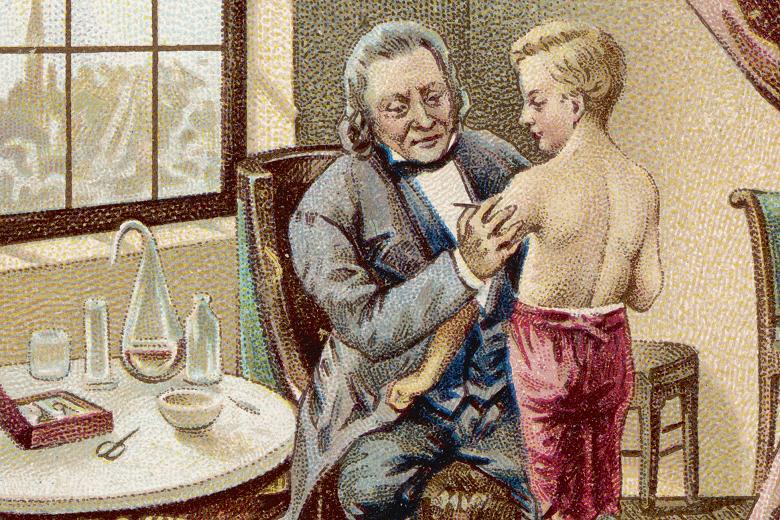
I want to click on chair, so click(x=630, y=371).